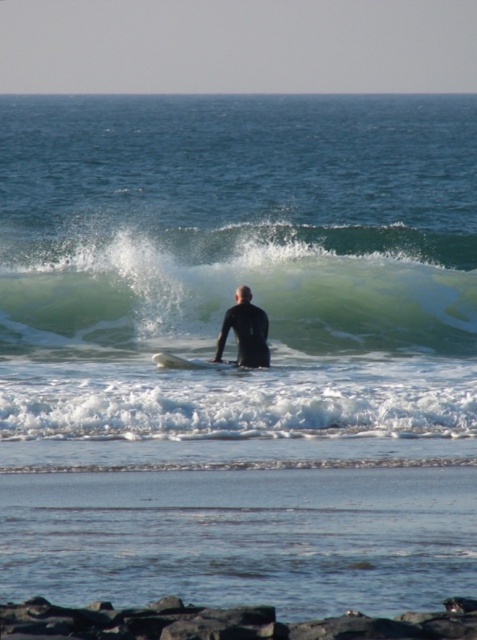
Does green rubber wave at center have a lesser width compared to black rubber surfboard at center?

Incorrect, green rubber wave at center's width is not less than black rubber surfboard at center's.

Who is shorter, green rubber wave at center or black rubber surfboard at center?

With less height is black rubber surfboard at center.

Is point (342, 289) behind point (170, 356)?

Yes, point (342, 289) is behind point (170, 356).

Where is `green rubber wave at center`? This screenshot has width=477, height=640. green rubber wave at center is located at coordinates (234, 285).

Does green rubber wave at center appear on the left side of black matte wetsuit at center?

No, green rubber wave at center is not to the left of black matte wetsuit at center.

Who is taller, green rubber wave at center or black matte wetsuit at center?

Standing taller between the two is green rubber wave at center.

Describe the element at coordinates (234, 285) in the screenshot. I see `green rubber wave at center` at that location.

Find the location of `green rubber wave at center`. green rubber wave at center is located at coordinates (234, 285).

Is black matte wetsuit at center positioned behind black rubber surfboard at center?

Yes, it is behind black rubber surfboard at center.

Is point (257, 332) positioned in front of point (170, 362)?

No, (257, 332) is further to viewer.

Does point (263, 332) come farther from viewer compared to point (155, 355)?

Yes, it is.

This screenshot has width=477, height=640. What are the coordinates of `black matte wetsuit at center` in the screenshot? It's located at (246, 332).